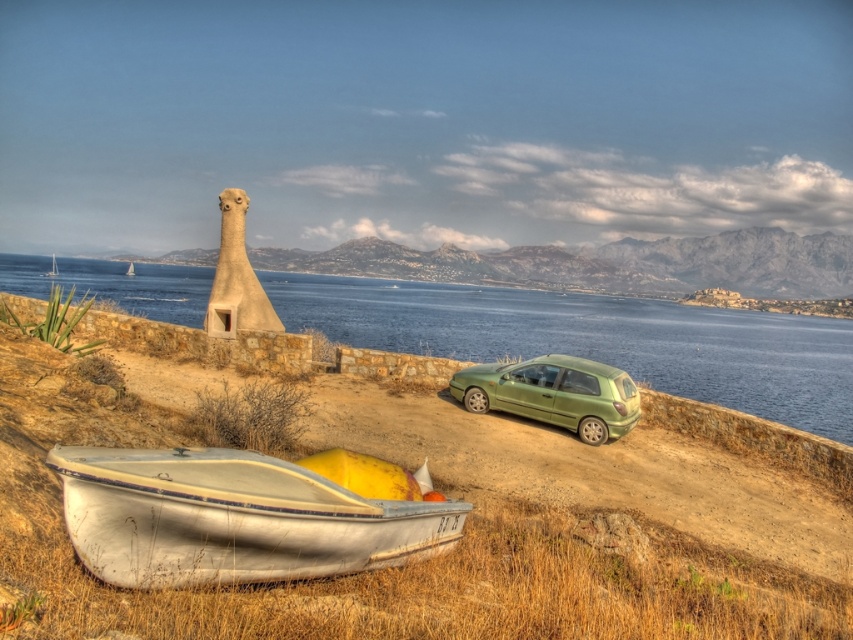
You are a photographer planning to capture the entire scene in one shot. Given that the blue water at center and the green matte hatchback at center are both in the frame, which object occupies more horizontal space in the image?

The blue water at center occupies more horizontal space because its width is larger than the green matte hatchback at center.

You are standing in the coastal scene and want to walk from the point closer to you to the point further away. Which path would you take between the two points, point (604,307) and point (184,460)?

You should walk from point (604,307) to point (184,460) because point (604,307) is closer to you than point (184,460).